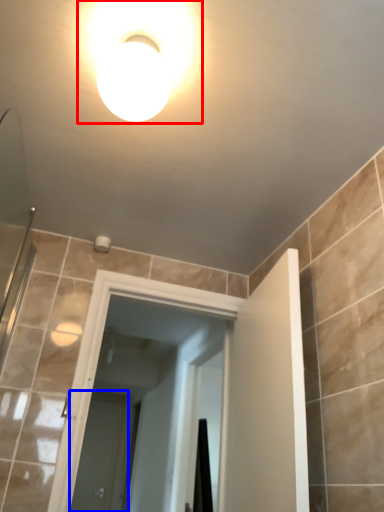
Question: Which object is further to the camera taking this photo, light fixture (highlighted by a red box) or screen door (highlighted by a blue box)?

Choices:
 (A) light fixture
 (B) screen door

Answer: (B)